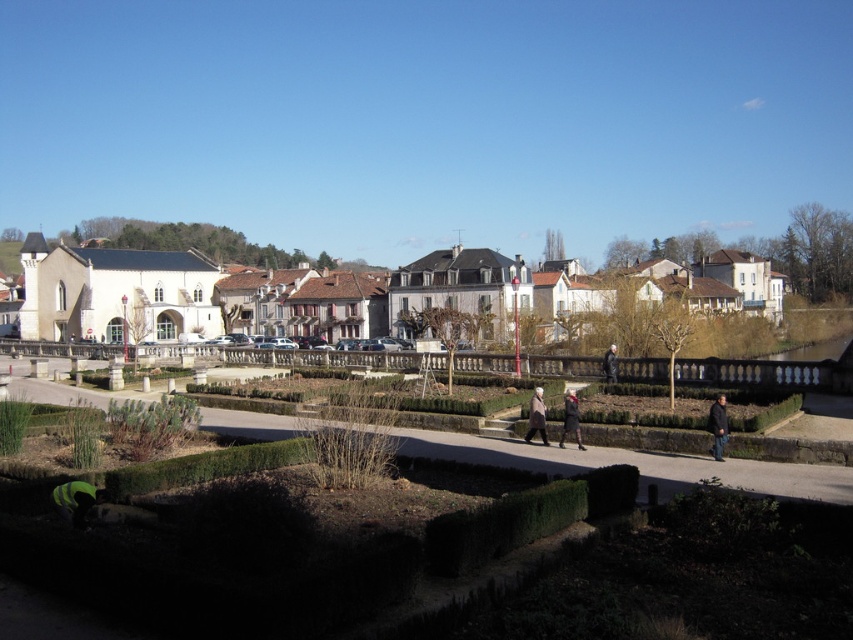
Between point (492, 273) and point (718, 403), which one is positioned behind?

Positioned behind is point (492, 273).

Is white stone buildings at center positioned behind black leather jacket at lower right?

That is True.

What do you see at coordinates (358, 292) in the screenshot?
I see `white stone buildings at center` at bounding box center [358, 292].

The height and width of the screenshot is (640, 853). I want to click on white stone buildings at center, so click(358, 292).

Can you confirm if green grass at center is shorter than black leather jacket at lower right?

Incorrect, green grass at center's height does not fall short of black leather jacket at lower right's.

Can you confirm if green grass at center is positioned to the left of black leather jacket at lower right?

Indeed, green grass at center is positioned on the left side of black leather jacket at lower right.

Describe the element at coordinates (194, 579) in the screenshot. I see `green grass at center` at that location.

The width and height of the screenshot is (853, 640). What are the coordinates of `green grass at center` in the screenshot? It's located at (194, 579).

Who is taller, green grass at center or dark brown leather coat at center?

green grass at center is taller.

The width and height of the screenshot is (853, 640). Describe the element at coordinates (194, 579) in the screenshot. I see `green grass at center` at that location.

This screenshot has height=640, width=853. I want to click on green grass at center, so click(x=194, y=579).

Find the location of a particular element. The width and height of the screenshot is (853, 640). green grass at center is located at coordinates (194, 579).